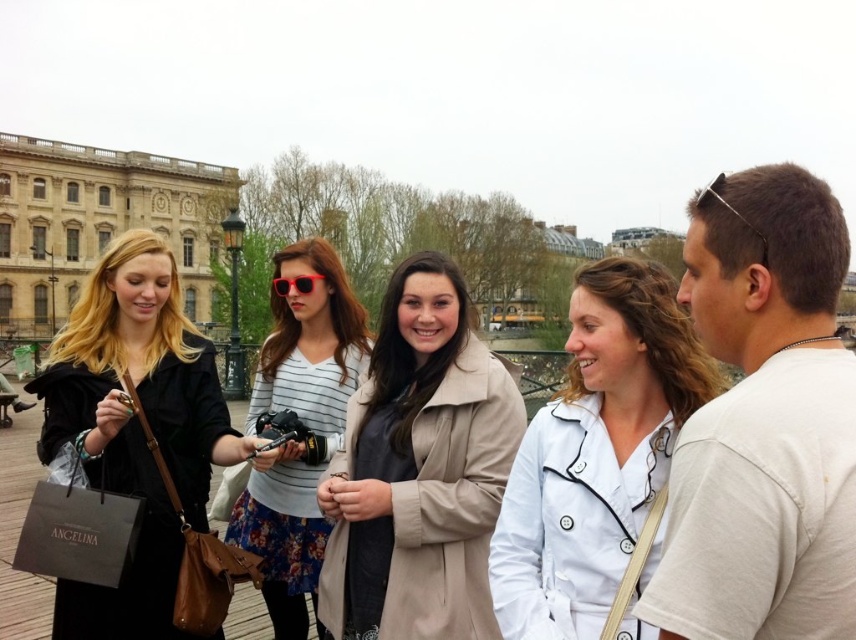
Question: Among these objects, which one is farthest from the camera?

Choices:
 (A) white matte coat at center
 (B) striped fabric shirt at center

Answer: (B)

Question: Is white matte coat at center below striped fabric shirt at center?

Choices:
 (A) no
 (B) yes

Answer: (A)

Question: Does matte black coat at center appear under striped fabric shirt at center?

Choices:
 (A) yes
 (B) no

Answer: (B)

Question: Which of these objects is positioned closest to the white matte coat at center?

Choices:
 (A) red plastic sunglasses at center
 (B) beige leather coat at center
 (C) light beige t-shirt at right
 (D) brown stone building at upper left

Answer: (C)

Question: Considering the real-world distances, which object is closest to the brown stone building at upper left?

Choices:
 (A) white matte coat at center
 (B) striped fabric shirt at center

Answer: (B)

Question: Observing the image, what is the correct spatial positioning of matte black coat at center in reference to brown stone building at upper left?

Choices:
 (A) right
 (B) left

Answer: (A)